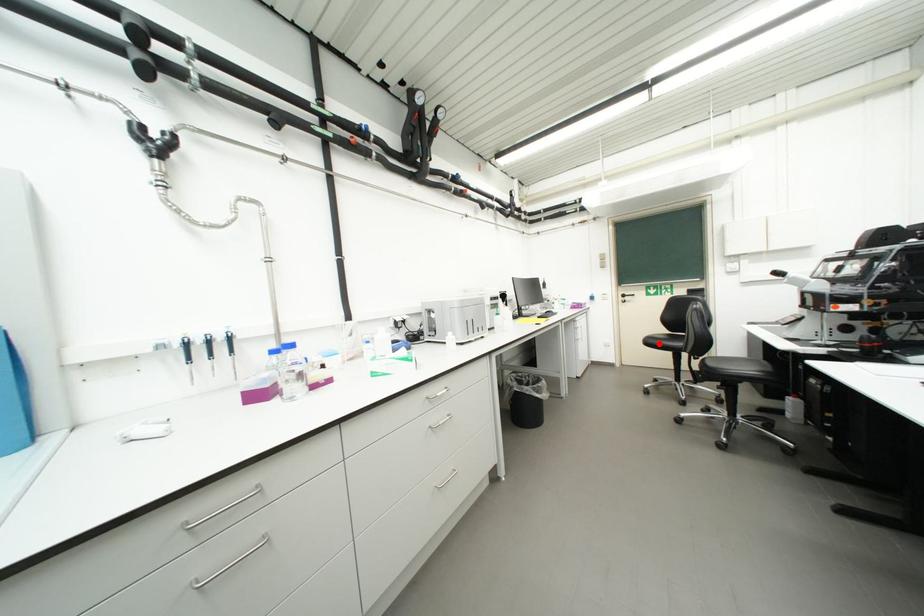
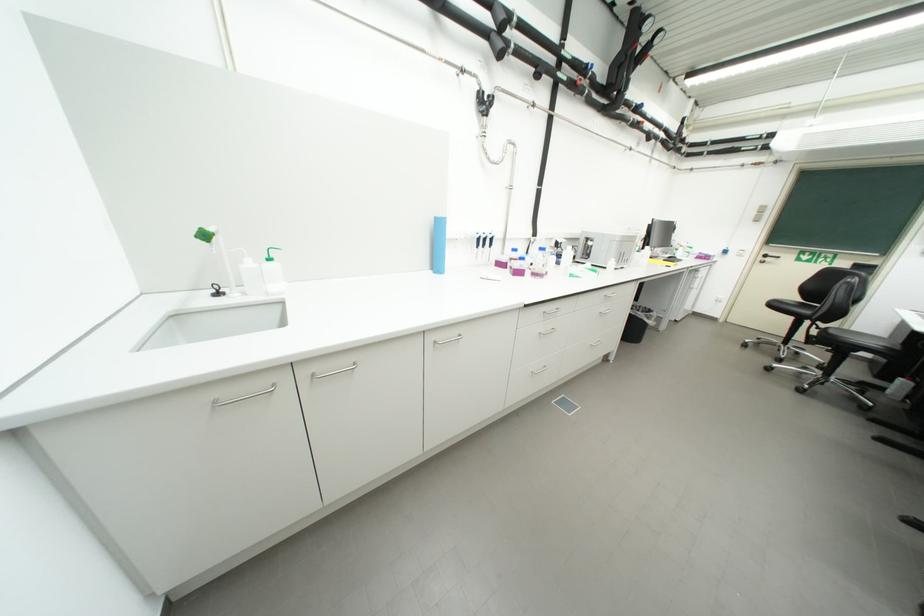
Locate, in the second image, the point that corresponds to the highlighted location in the first image.

(783, 307)